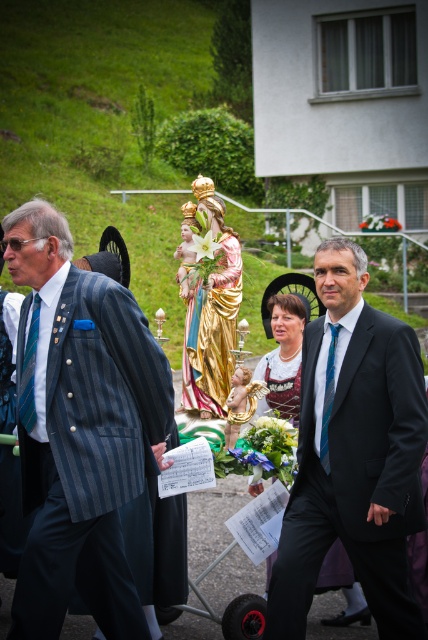
Question: Which object is farther from the camera taking this photo?

Choices:
 (A) blue silk tie at center
 (B) dark blue suit at center
 (C) blue striped tie at left

Answer: (A)

Question: Estimate the real-world distances between objects in this image. Which object is closer to the blue silk tie at center?

Choices:
 (A) dark blue suit at center
 (B) blue striped tie at left
 (C) gold metallic statue at center
 (D) striped wool suit at left

Answer: (A)

Question: Does striped wool suit at left appear under gold metallic statue at center?

Choices:
 (A) no
 (B) yes

Answer: (A)

Question: Which point is closer to the camera?

Choices:
 (A) striped wool suit at left
 (B) gold metallic statue at center
 (C) blue striped tie at left

Answer: (A)

Question: Does striped wool suit at left come behind gold metallic statue at center?

Choices:
 (A) yes
 (B) no

Answer: (B)

Question: Is striped wool suit at left further to camera compared to dark blue suit at center?

Choices:
 (A) no
 (B) yes

Answer: (A)